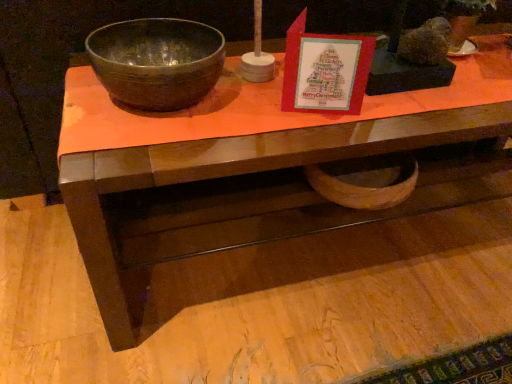
At what (x,y) coordinates should I click in order to perform the action: click on free space on the front side of matte brown bowl at left. Please return your answer as a coordinate pair (x, y). Looking at the image, I should click on tap(146, 147).